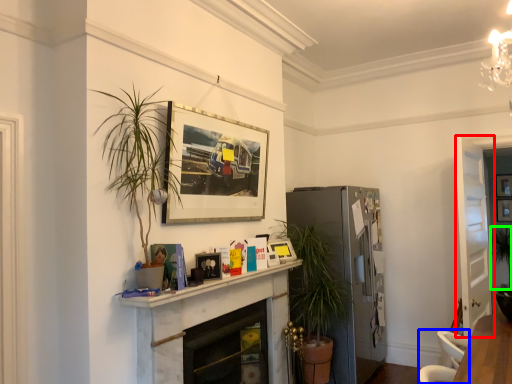
Question: Based on their relative distances, which object is nearer to glass door (highlighted by a red box)? Choose from swivel chair (highlighted by a blue box) and plant (highlighted by a green box).

Choices:
 (A) swivel chair
 (B) plant

Answer: (B)